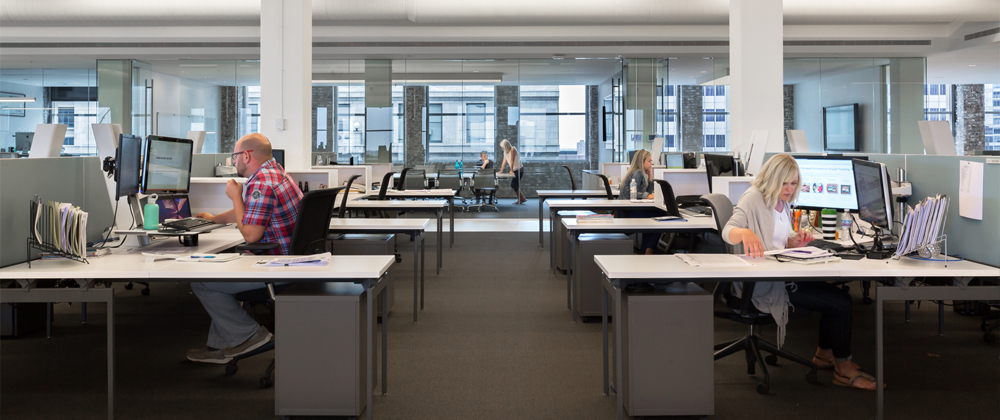
The height and width of the screenshot is (420, 1000). Find the location of `windows`. windows is located at coordinates (712, 110), (672, 114), (551, 100), (458, 109), (353, 110), (249, 112), (65, 103), (993, 119).